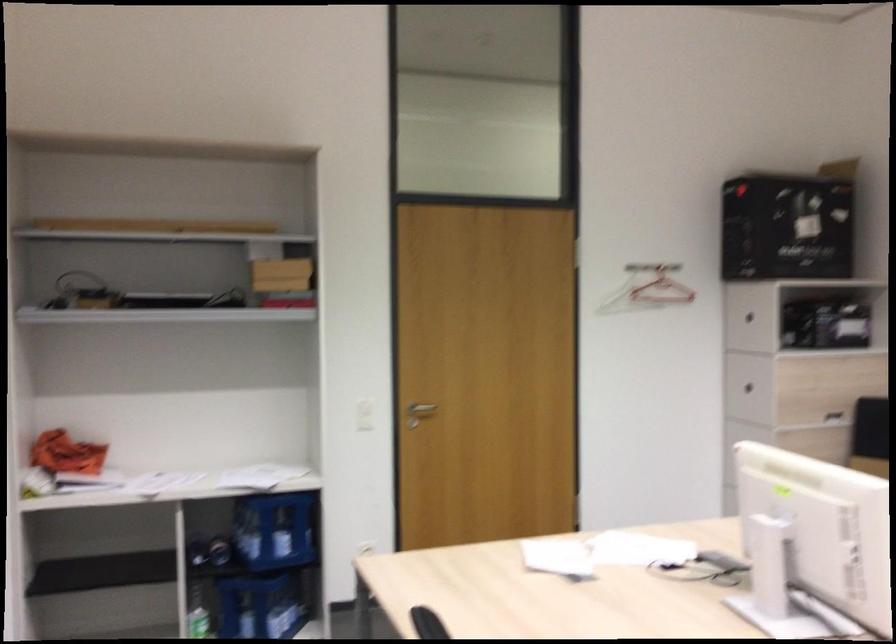
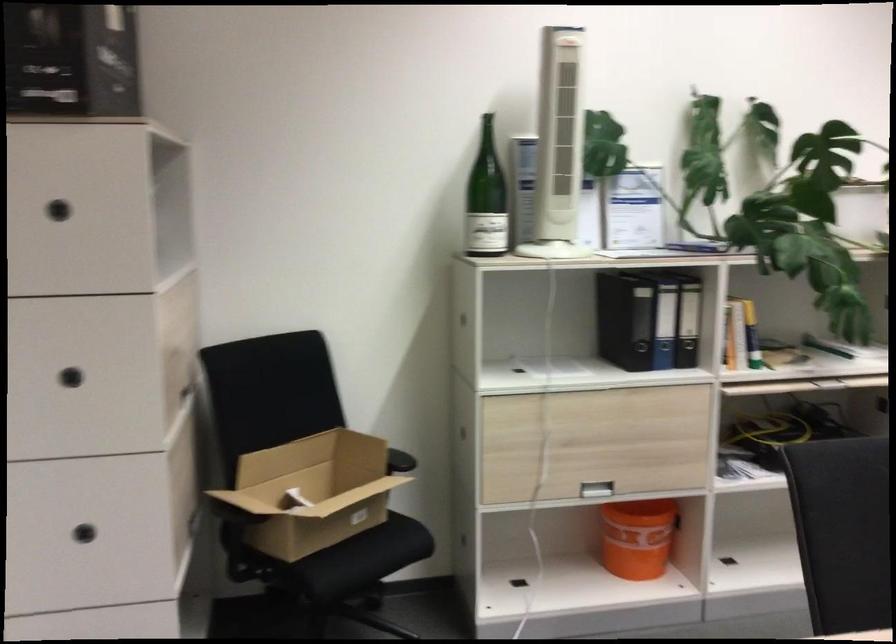
The point at (x=760, y=316) is marked in the first image. Where is the corresponding point in the second image?

(59, 210)